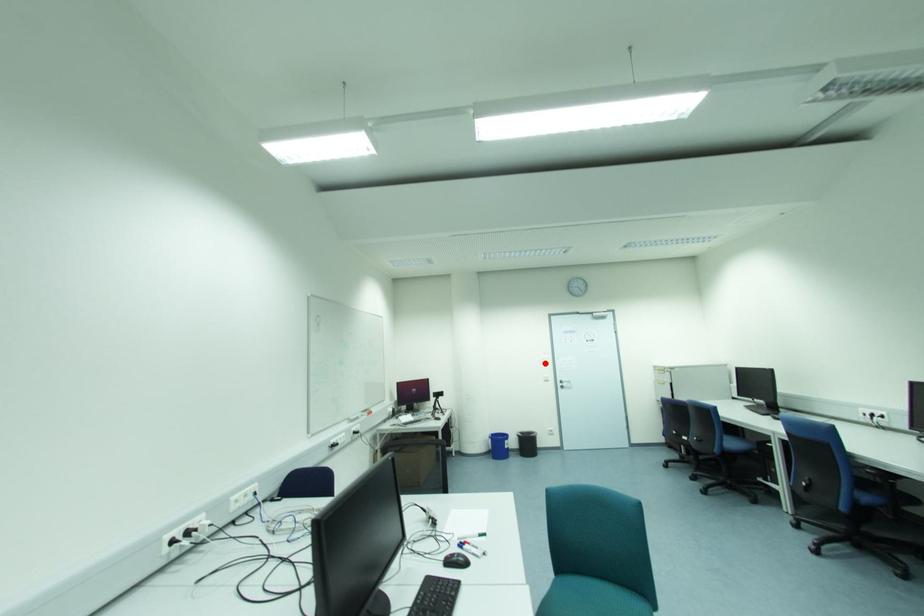
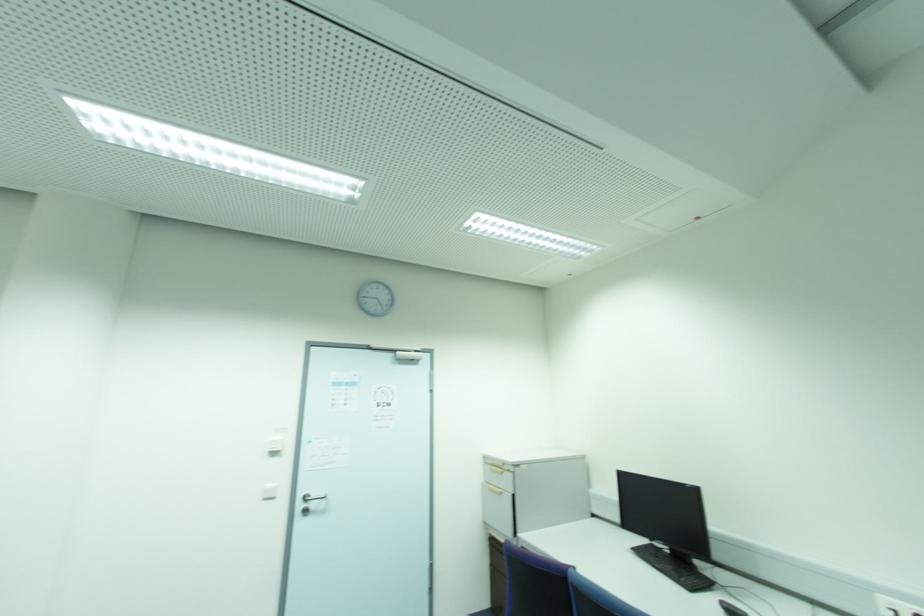
Where in the second image is the point corresponding to the highlighted location from the first image?

(274, 454)